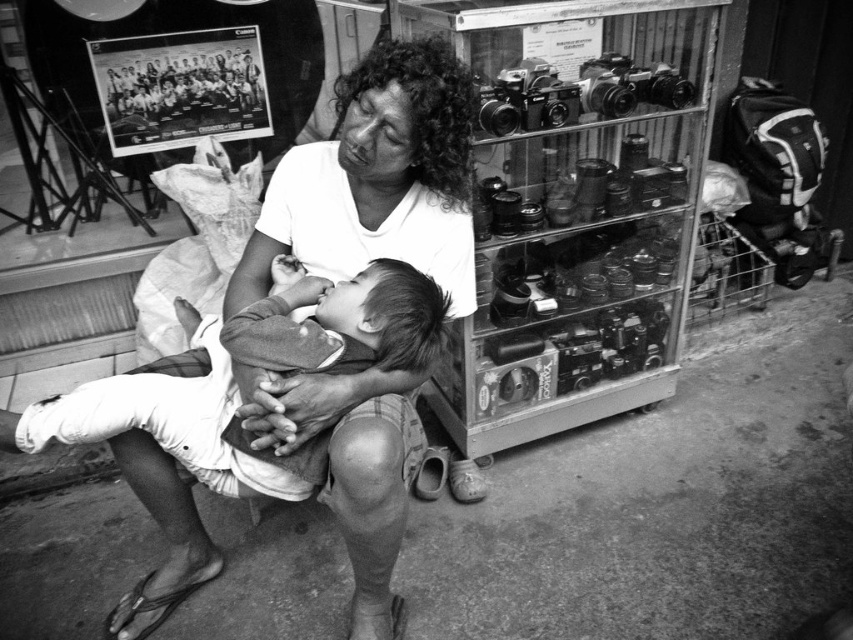
Which of these two, white cotton shirt at center or soft cotton baby at center, stands shorter?

soft cotton baby at center is shorter.

Is white cotton shirt at center smaller than soft cotton baby at center?

No.

The image size is (853, 640). What are the coordinates of `white cotton shirt at center` in the screenshot? It's located at (376, 179).